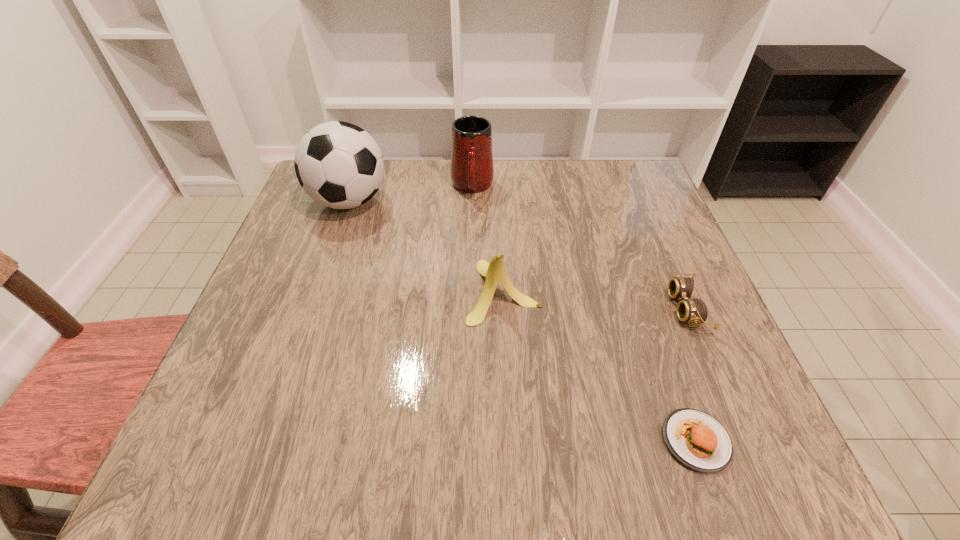
You are a GUI agent. You are given a task and a screenshot of the screen. Output one action in this format:
    pyautogui.click(x=<x>, y=<y>)
    Task: Click on the soccer ball
    
    Given the screenshot: What is the action you would take?
    pyautogui.click(x=338, y=164)

Where is `the leftmost object`? the leftmost object is located at coordinates (338, 164).

Find the location of a particular element. mug is located at coordinates [472, 170].

The height and width of the screenshot is (540, 960). I want to click on the third shortest object, so click(495, 272).

This screenshot has width=960, height=540. What are the coordinates of `goggles` in the screenshot? It's located at (692, 311).

In order to click on food in this screenshot , I will do `click(696, 439)`.

This screenshot has width=960, height=540. I want to click on the shortest object, so click(696, 439).

The width and height of the screenshot is (960, 540). In order to click on free space located 0.270m on the front of the tallest object in this screenshot , I will do `click(311, 314)`.

Identify the location of vacant region located on the side of the fourth shortest object with the handle. (470, 281).

Image resolution: width=960 pixels, height=540 pixels. What are the coordinates of `free space located 0.290m on the right of the banana` in the screenshot? It's located at (680, 291).